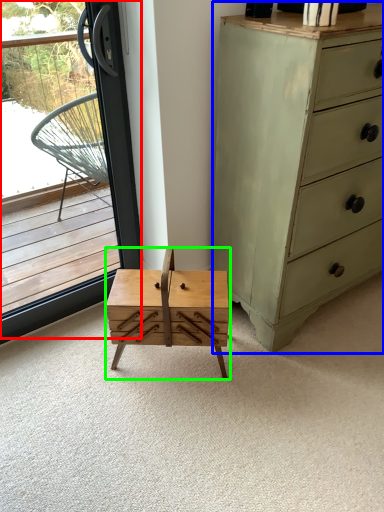
Question: Which is nearer to the window (highlighted by a red box)? chest of drawers (highlighted by a blue box) or table (highlighted by a green box).

Choices:
 (A) chest of drawers
 (B) table

Answer: (B)